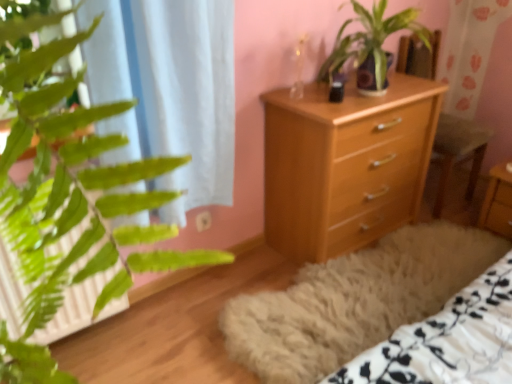
Question: Does wooden armchair at center appear on the left side of wooden nightstand at center?

Choices:
 (A) yes
 (B) no

Answer: (A)

Question: From a real-world perspective, is wooden armchair at center below wooden nightstand at center?

Choices:
 (A) no
 (B) yes

Answer: (A)

Question: Is the position of wooden armchair at center more distant than that of wooden nightstand at center?

Choices:
 (A) no
 (B) yes

Answer: (A)

Question: Could wooden nightstand at center be considered to be inside wooden armchair at center?

Choices:
 (A) no
 (B) yes

Answer: (A)

Question: Is wooden armchair at center taller than wooden nightstand at center?

Choices:
 (A) no
 (B) yes

Answer: (B)

Question: Is wooden armchair at center facing towards wooden nightstand at center?

Choices:
 (A) yes
 (B) no

Answer: (A)

Question: Does light wood chest of drawers at center have a greater height compared to white sheer curtain at left?

Choices:
 (A) yes
 (B) no

Answer: (B)

Question: Is light wood chest of drawers at center turned away from white sheer curtain at left?

Choices:
 (A) no
 (B) yes

Answer: (A)

Question: Considering the relative sizes of light wood chest of drawers at center and white sheer curtain at left in the image provided, is light wood chest of drawers at center shorter than white sheer curtain at left?

Choices:
 (A) no
 (B) yes

Answer: (B)

Question: Would you say white sheer curtain at left is part of light wood chest of drawers at center's contents?

Choices:
 (A) yes
 (B) no

Answer: (B)

Question: Is light wood chest of drawers at center at the right side of white sheer curtain at left?

Choices:
 (A) yes
 (B) no

Answer: (A)

Question: Is light wood chest of drawers at center beside white sheer curtain at left?

Choices:
 (A) no
 (B) yes

Answer: (A)

Question: Considering the relative sizes of wooden armchair at center and green leafy plant at center in the image provided, is wooden armchair at center smaller than green leafy plant at center?

Choices:
 (A) yes
 (B) no

Answer: (B)